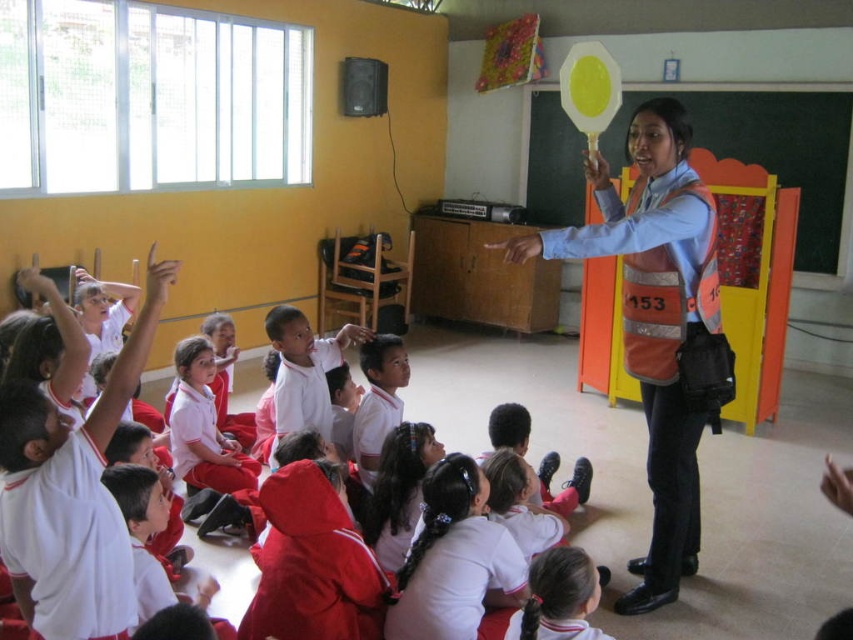
From the picture: Between white matte hairband at center and white smooth shirt at center, which one has less height?

With less height is white matte hairband at center.

Does white matte hairband at center appear under white smooth shirt at center?

Yes.

What do you see at coordinates (454, 557) in the screenshot? I see `white matte hairband at center` at bounding box center [454, 557].

The width and height of the screenshot is (853, 640). Identify the location of white matte hairband at center. (454, 557).

Is orange reflective vest at center thinner than white matte uniform at center?

No.

Identify the location of orange reflective vest at center. (654, 321).

Identify the location of orange reflective vest at center. (654, 321).

I want to click on orange reflective vest at center, so click(654, 321).

Is orange reflective vest at center thinner than white smooth shirt at center?

In fact, orange reflective vest at center might be wider than white smooth shirt at center.

Measure the distance between point (653, 506) and camera.

The distance of point (653, 506) from camera is 3.15 meters.

Locate an element on the screen. The image size is (853, 640). orange reflective vest at center is located at coordinates (654, 321).